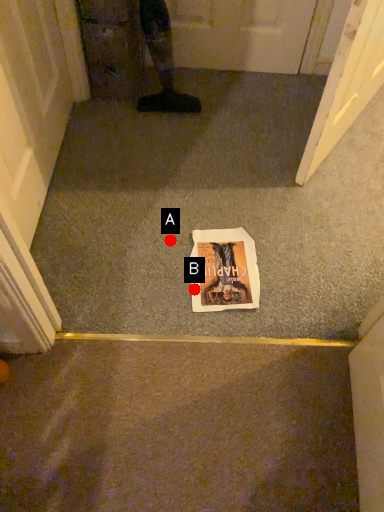
Question: Two points are circled on the image, labeled by A and B beside each circle. Which point is farther from the camera taking this photo?

Choices:
 (A) A is further
 (B) B is further

Answer: (A)